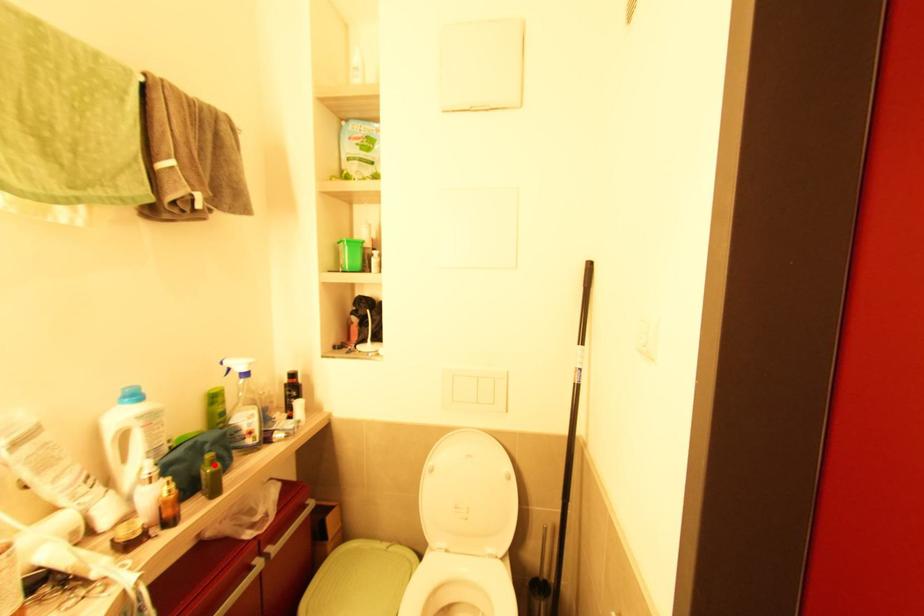
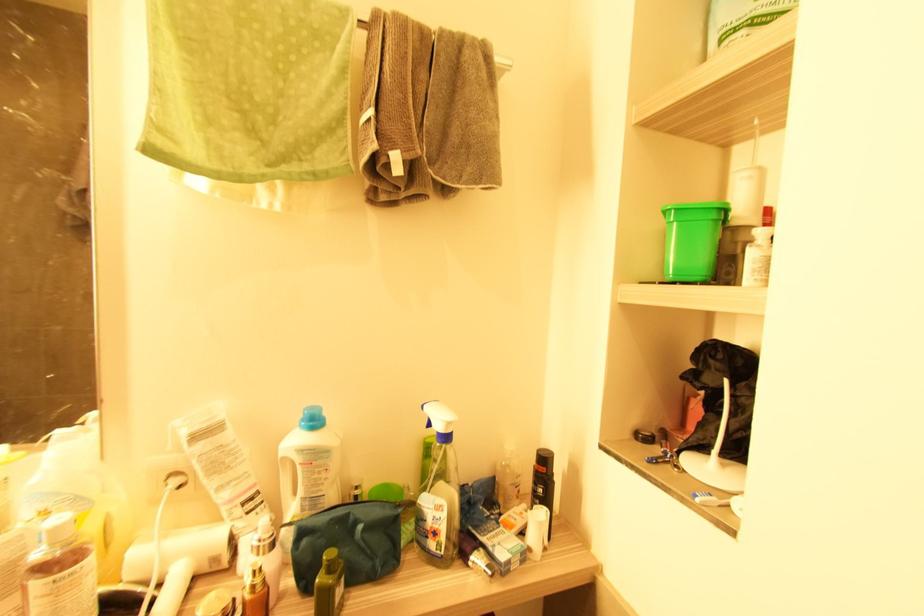
Where in the second image is the point corresponding to the highlighted location from the first image?

(331, 572)